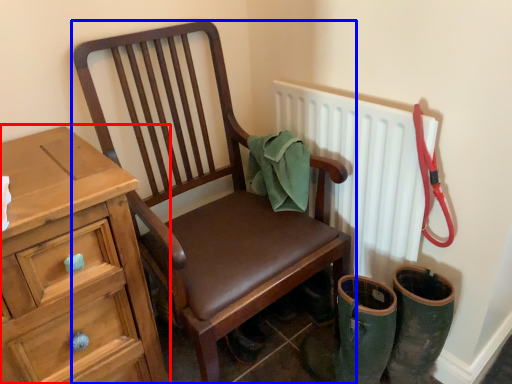
Question: Which object appears farthest to the camera in this image, chest of drawers (highlighted by a red box) or chair (highlighted by a blue box)?

Choices:
 (A) chest of drawers
 (B) chair

Answer: (B)